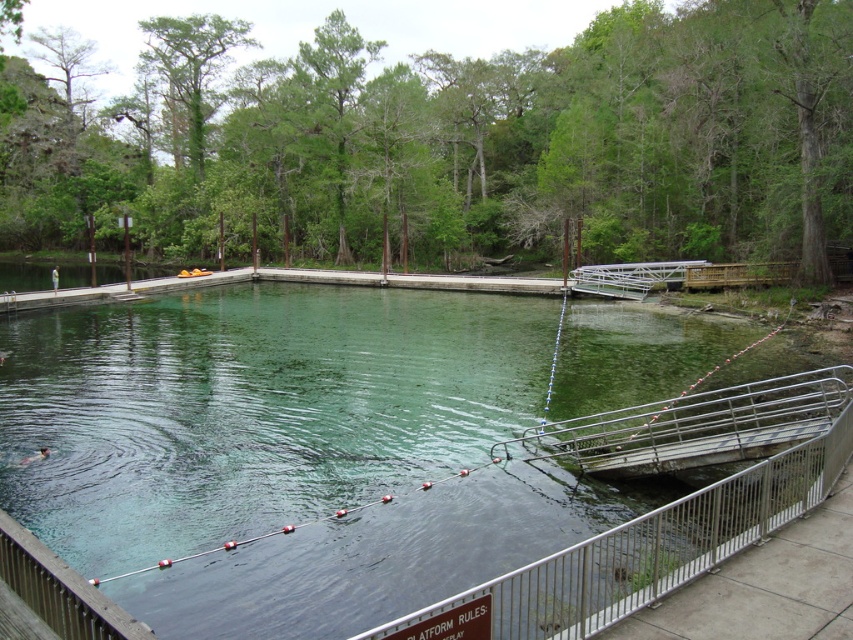
You are standing at the diving platform and want to jump into the water. You notice two points marked on the water surface. The first point is at coordinates point (693, 426) and the second is at point (564, 628). Which point is closer to the diving platform?

Point (693, 426) is behind point (564, 628), so the point closer to the diving platform is point (564, 628).